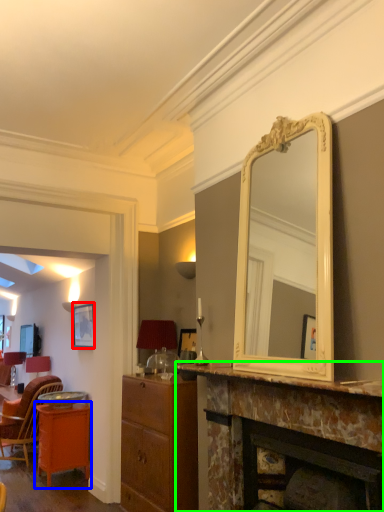
Question: Estimate the real-world distances between objects in this image. Which object is closer to picture frame (highlighted by a red box), table (highlighted by a blue box) or fireplace (highlighted by a green box)?

Choices:
 (A) table
 (B) fireplace

Answer: (A)